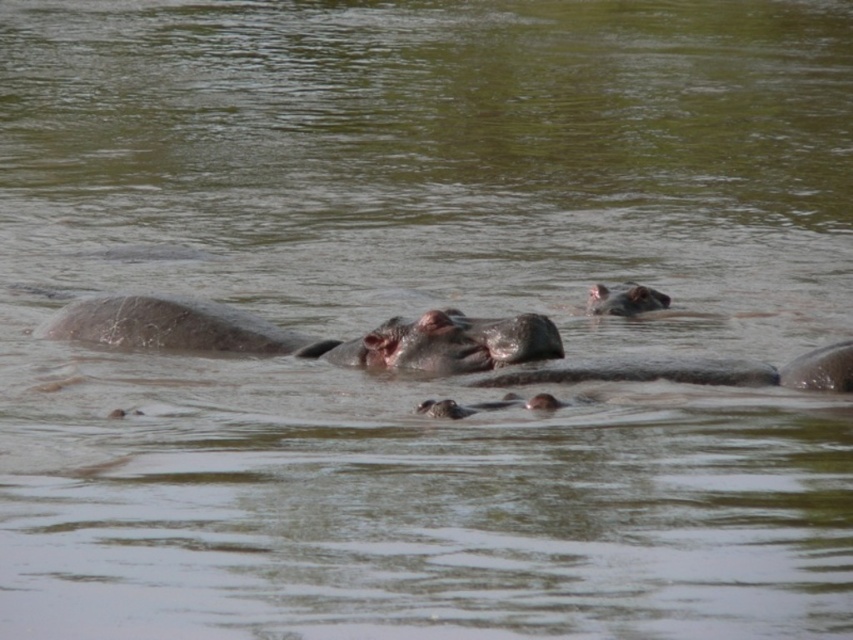
You are a wildlife photographer aiming to capture a closeup shot of the gray matte hippo at center and the gray matte hippo at upper center. Since you want to focus on the larger hippo, which one should you point your camera at?

The gray matte hippo at center is bigger than the gray matte hippo at upper center, so you should point your camera at the gray matte hippo at center to capture the larger one.

You are observing the hippos in the water. Which hippo is taller between the pink matte hippo at center and the gray matte hippo at center?

The pink matte hippo at center is much taller than the gray matte hippo at center.